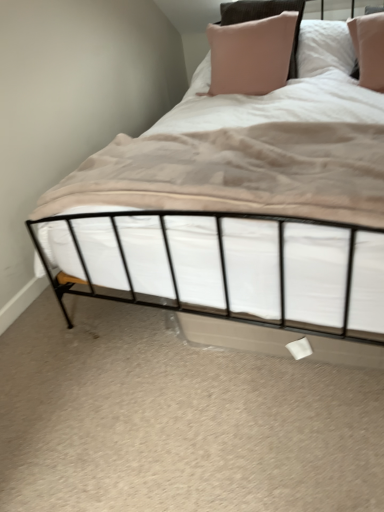
Question: Does pink fabric pillow at upper center have a greater height compared to beige soft fabric at center?

Choices:
 (A) no
 (B) yes

Answer: (B)

Question: Can you confirm if pink fabric pillow at upper center is wider than beige soft fabric at center?

Choices:
 (A) no
 (B) yes

Answer: (A)

Question: Can you confirm if pink fabric pillow at upper center is thinner than beige soft fabric at center?

Choices:
 (A) no
 (B) yes

Answer: (B)

Question: Can you confirm if pink fabric pillow at upper center is smaller than beige soft fabric at center?

Choices:
 (A) no
 (B) yes

Answer: (A)

Question: From the image's perspective, would you say pink fabric pillow at upper center is shown under beige soft fabric at center?

Choices:
 (A) yes
 (B) no

Answer: (B)

Question: Does pink fabric pillow at upper center appear on the right side of beige soft fabric at center?

Choices:
 (A) yes
 (B) no

Answer: (A)

Question: Is beige soft fabric at center further to camera compared to pink fabric pillow at upper center?

Choices:
 (A) yes
 (B) no

Answer: (B)

Question: From the image's perspective, is beige soft fabric at center on pink fabric pillow at upper center?

Choices:
 (A) no
 (B) yes

Answer: (A)

Question: From the image's perspective, is beige soft fabric at center below pink fabric pillow at upper center?

Choices:
 (A) no
 (B) yes

Answer: (B)

Question: Is beige soft fabric at center completely or partially outside of pink fabric pillow at upper center?

Choices:
 (A) no
 (B) yes

Answer: (B)

Question: Is the depth of beige soft fabric at center less than that of pink fabric pillow at upper center?

Choices:
 (A) yes
 (B) no

Answer: (A)

Question: From a real-world perspective, is beige soft fabric at center on top of pink fabric pillow at upper center?

Choices:
 (A) yes
 (B) no

Answer: (B)

Question: Which is correct: pink fabric pillow at upper center is inside beige soft fabric at center, or outside of it?

Choices:
 (A) inside
 (B) outside

Answer: (B)